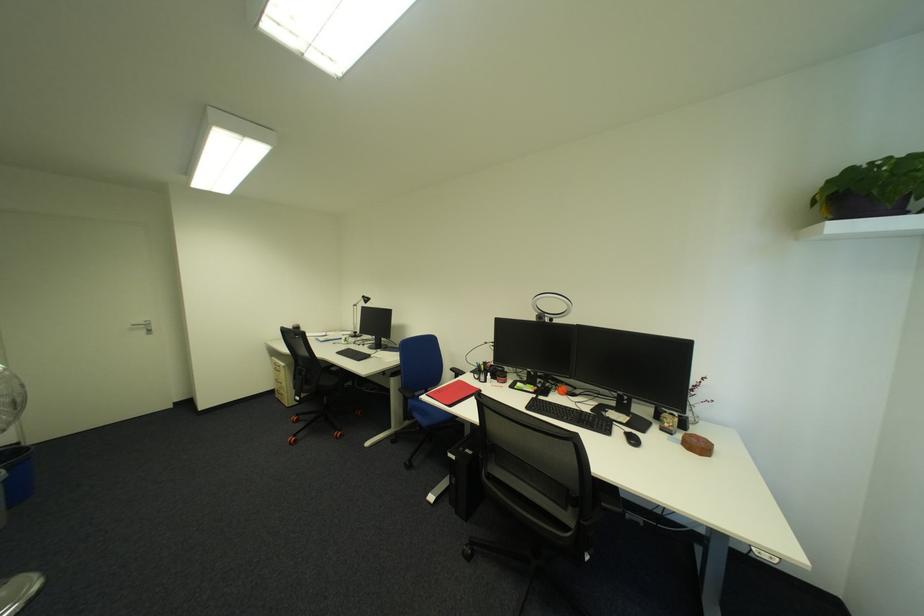
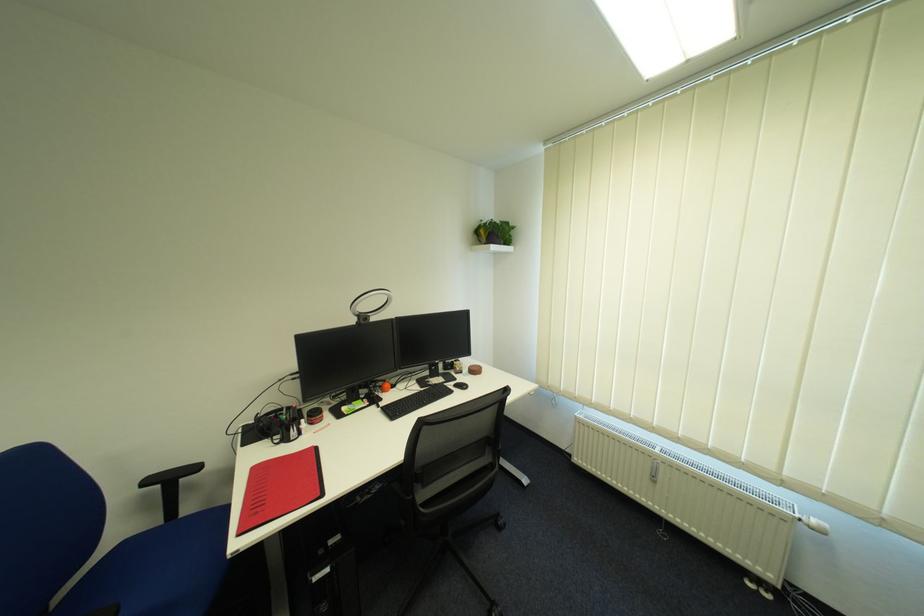
Locate, in the second image, the point that corresponds to (x=820, y=565) in the first image.

(548, 387)